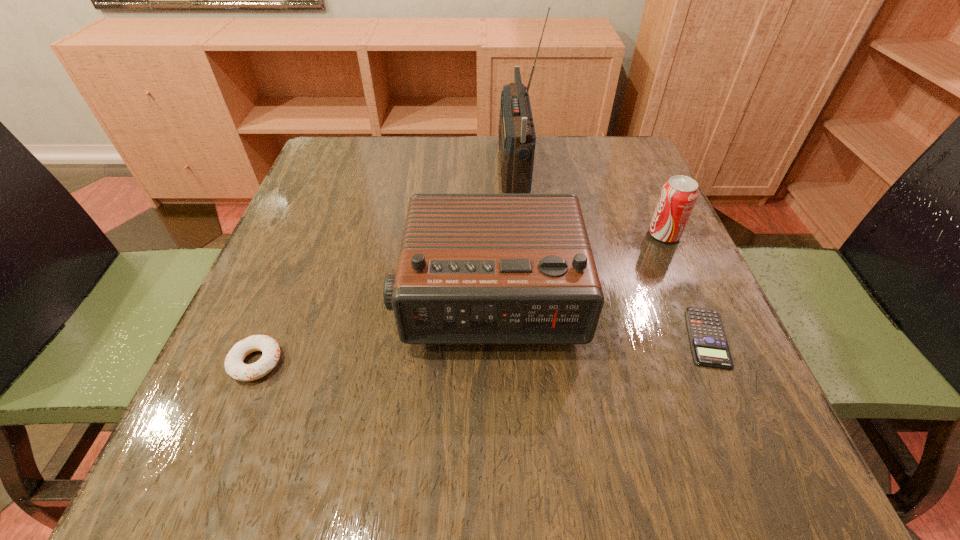
You are a GUI agent. You are given a task and a screenshot of the screen. Output one action in this format:
    pyautogui.click(x=<x>, y=<y>)
    Task: Click on the unoccupied area between the third tallest object and the farthest object
    This screenshot has height=540, width=960.
    Given the screenshot: What is the action you would take?
    pyautogui.click(x=588, y=201)

What are the coordinates of `empty space between the shortest object and the farthest object` in the screenshot? It's located at (610, 252).

This screenshot has width=960, height=540. Find the location of `vacant area that lies between the farthest object and the calculator`. vacant area that lies between the farthest object and the calculator is located at coordinates pos(610,252).

In order to click on unoccupied area between the second tallest object and the leftmost object in this screenshot , I will do `click(372, 330)`.

Locate an element on the screen. The width and height of the screenshot is (960, 540). blank region between the tallest object and the doughnut is located at coordinates (385, 265).

Find the location of `object that stands as the second closest to the second farthest object`. object that stands as the second closest to the second farthest object is located at coordinates click(473, 268).

I want to click on object that ranks as the second closest to the soda can, so click(473, 268).

Identify the location of vacant space that satisfies the following two spatial constraints: 1. on the front-facing side of the tallest object; 2. on the front panel of the shorter radio receiver. The width and height of the screenshot is (960, 540). (526, 298).

Find the location of a particular element. This screenshot has width=960, height=540. vacant space that satisfies the following two spatial constraints: 1. on the front panel of the shortest object; 2. on the right side of the fourth shortest object is located at coordinates (489, 338).

Locate an element on the screen. The width and height of the screenshot is (960, 540). free spot that satisfies the following two spatial constraints: 1. on the front-facing side of the farther radio receiver; 2. on the front panel of the second tallest object is located at coordinates (526, 298).